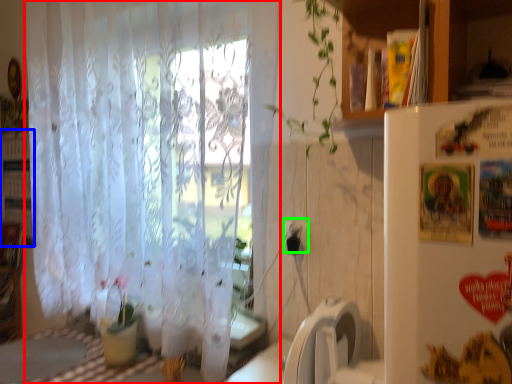
Question: Which object is positioned closest to curtain (highlighted by a red box)? Select from bookshelf (highlighted by a blue box) and electric outlet (highlighted by a green box).

Choices:
 (A) bookshelf
 (B) electric outlet

Answer: (B)